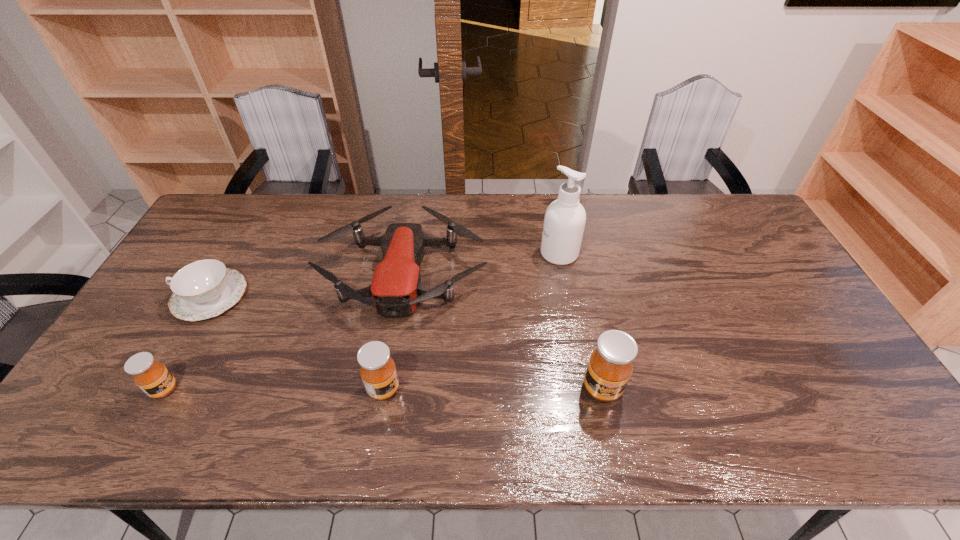
I want to click on the closest object to the second shortest honey, so click(x=396, y=288).

Choose which object is the fourth nearest neighbor to the drone. Please provide its 2D coordinates. Your answer should be formatted as a tuple, i.e. [(x, y)], where the tuple contains the x and y coordinates of a point satisfying the conditions above.

[(609, 368)]

I want to click on the third closest honey to the drone, so click(153, 378).

Image resolution: width=960 pixels, height=540 pixels. In order to click on honey that is the nearest to the fifth shortest object in this screenshot , I will do `click(378, 371)`.

Locate an element on the screen. Image resolution: width=960 pixels, height=540 pixels. free spot that satisfies the following two spatial constraints: 1. on the front-facing side of the drone; 2. on the handle side of the shortest object is located at coordinates (399, 296).

Where is `vacant area that satisfies the following two spatial constraints: 1. on the front-facing side of the fifth shortest object; 2. on the front-facing side of the shortest honey`? Image resolution: width=960 pixels, height=540 pixels. vacant area that satisfies the following two spatial constraints: 1. on the front-facing side of the fifth shortest object; 2. on the front-facing side of the shortest honey is located at coordinates (603, 389).

You are a GUI agent. You are given a task and a screenshot of the screen. Output one action in this format:
    pyautogui.click(x=<x>, y=<y>)
    Task: Click on the free space in the image that satisfies the following two spatial constraints: 1. on the front-facing side of the rightmost honey; 2. on the front-facing side of the third tallest object
    
    Given the screenshot: What is the action you would take?
    pyautogui.click(x=602, y=389)

This screenshot has width=960, height=540. What are the coordinates of `vacant area in the image that satisfies the following two spatial constraints: 1. on the front-facing side of the drone; 2. on the handle side of the shortest object` in the screenshot? It's located at (399, 296).